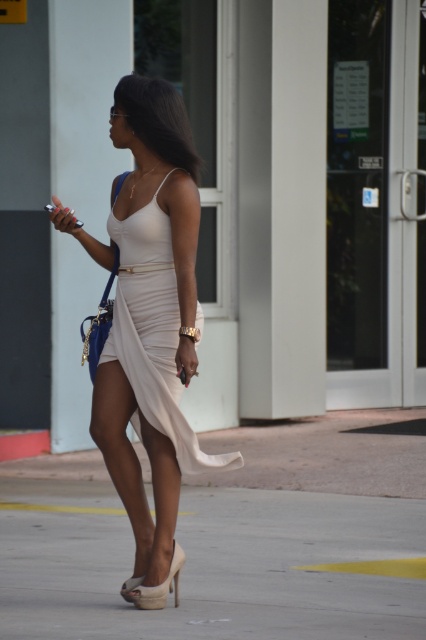
Does matte white dress at center have a lesser width compared to white satin dress at center?

No.

Between matte white dress at center and white satin dress at center, which one has less height?

white satin dress at center is shorter.

You are a GUI agent. You are given a task and a screenshot of the screen. Output one action in this format:
    pyautogui.click(x=<x>, y=<y>)
    Task: Click on the matte white dress at center
    Image resolution: width=426 pixels, height=640 pixels.
    Given the screenshot: What is the action you would take?
    pyautogui.click(x=149, y=314)

Image resolution: width=426 pixels, height=640 pixels. Identify the location of matte white dress at center. (149, 314).

Which is more to the right, beige concrete pavement at lower center or beige suede sandal at lower center?

From the viewer's perspective, beige concrete pavement at lower center appears more on the right side.

Is point (55, 627) more distant than point (129, 579)?

No, (55, 627) is closer to viewer.

Where is `beige concrete pavement at lower center`? This screenshot has width=426, height=640. beige concrete pavement at lower center is located at coordinates click(209, 564).

Does beige concrete pavement at lower center have a lesser height compared to matte white dress at center?

Indeed, beige concrete pavement at lower center has a lesser height compared to matte white dress at center.

Is point (307, 598) less distant than point (155, 360)?

No, (307, 598) is further to viewer.

This screenshot has width=426, height=640. In order to click on beige concrete pavement at lower center in this screenshot , I will do `click(209, 564)`.